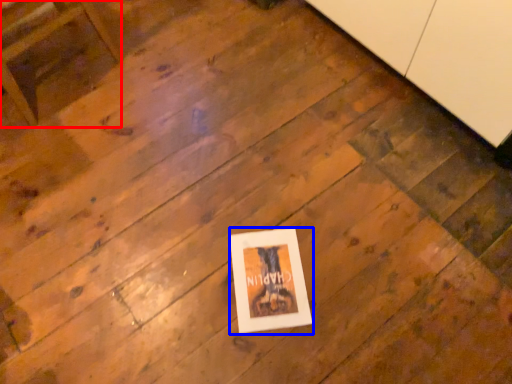
Question: Among these objects, which one is nearest to the camera, furniture (highlighted by a red box) or picture frame (highlighted by a blue box)?

Choices:
 (A) furniture
 (B) picture frame

Answer: (A)